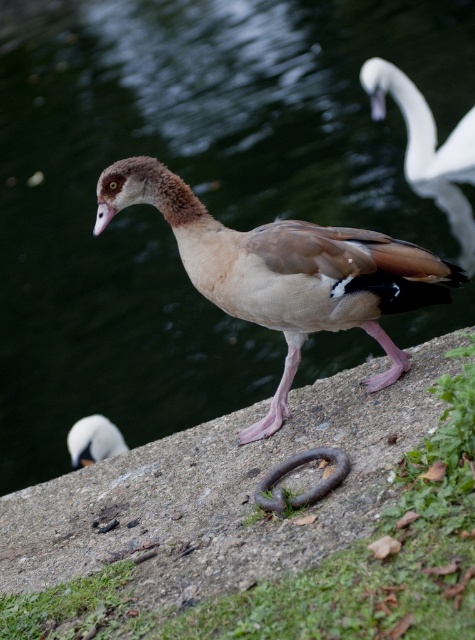
Question: Which object is closer to the camera taking this photo?

Choices:
 (A) rusty metal ring at center
 (B) white glossy swan at lower left
 (C) white matte beak at upper right
 (D) brown matte beak at center

Answer: (A)

Question: Can you confirm if white matte beak at upper right is wider than brown matte beak at center?

Choices:
 (A) yes
 (B) no

Answer: (A)

Question: Which point is closer to the camera?

Choices:
 (A) (430, 173)
 (B) (426, 257)
 (C) (382, 115)

Answer: (B)

Question: Which object is farther from the camera taking this photo?

Choices:
 (A) white matte beak at upper right
 (B) brown rubber ring at lower center
 (C) white glossy swan at upper right

Answer: (A)

Question: Is brown rubber ring at lower center positioned before white matte beak at upper right?

Choices:
 (A) yes
 (B) no

Answer: (A)

Question: Is rusty metal ring at center to the left of white glossy swan at upper right from the viewer's perspective?

Choices:
 (A) no
 (B) yes

Answer: (B)